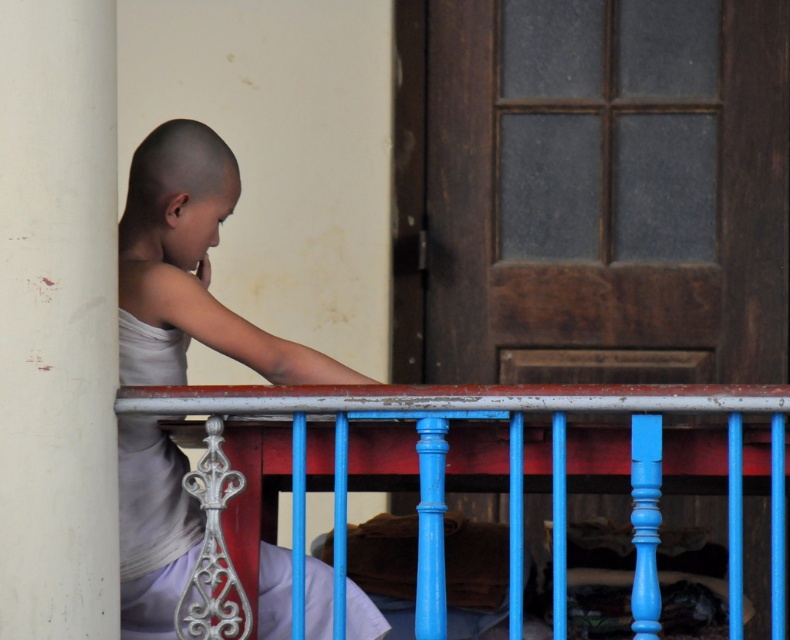
Question: Can you confirm if blue painted wood balustrade at center is bigger than white matte shirt at left?

Choices:
 (A) yes
 (B) no

Answer: (A)

Question: Estimate the real-world distances between objects in this image. Which object is closer to the blue painted wood balustrade at center?

Choices:
 (A) white matte pillar at left
 (B) white matte shirt at left

Answer: (B)

Question: Is white matte pillar at left below white matte shirt at left?

Choices:
 (A) yes
 (B) no

Answer: (B)

Question: Which object is farther from the camera taking this photo?

Choices:
 (A) blue painted wood balustrade at center
 (B) white matte shirt at left

Answer: (B)

Question: Among these points, which one is nearest to the camera?

Choices:
 (A) (251, 531)
 (B) (100, 451)

Answer: (B)

Question: Does blue painted wood balustrade at center appear on the left side of white matte shirt at left?

Choices:
 (A) yes
 (B) no

Answer: (B)